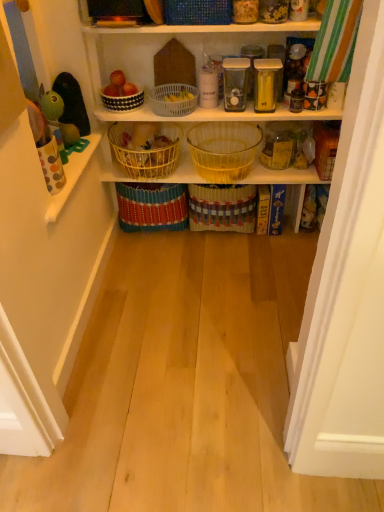
Question: Is bright yellow woven basket at center, which appears as the 2th basket when ordered from the bottom, to the left or to the right of yellow wire basket at center, positioned as the 4th basket in top-to-bottom order, in the image?

Choices:
 (A) right
 (B) left

Answer: (A)

Question: Relative to yellow wire basket at center, positioned as the 4th basket in top-to-bottom order, is bright yellow woven basket at center, which appears as the 6th basket when viewed from the top, in front or behind?

Choices:
 (A) front
 (B) behind

Answer: (B)

Question: Estimate the real-world distances between objects in this image. Which object is farther from the yellow wire basket at center, the 4th basket positioned from the bottom?

Choices:
 (A) translucent glass jars at upper center
 (B) bright yellow woven basket at center, which appears as the 6th basket when viewed from the top
 (C) blue woven basket at upper center, marked as the 1th basket in a top-to-bottom arrangement
 (D) translucent yellow glass basket at center, placed as the third basket when sorted from bottom to top
 (E) white dotted bowl at upper center, placed as the second basket when sorted from top to bottom

Answer: (C)

Question: Which object is positioned closest to the bright yellow woven basket at center, which appears as the 6th basket when viewed from the top?

Choices:
 (A) white plastic basket at upper center, which is counted as the third basket, starting from the top
 (B) translucent glass jars at upper center
 (C) blue woven basket at upper center, marked as the 1th basket in a top-to-bottom arrangement
 (D) yellow wire basket at center, the 4th basket positioned from the bottom
 (E) woven straw basket at center, which is the 7th basket in top-to-bottom order

Answer: (E)